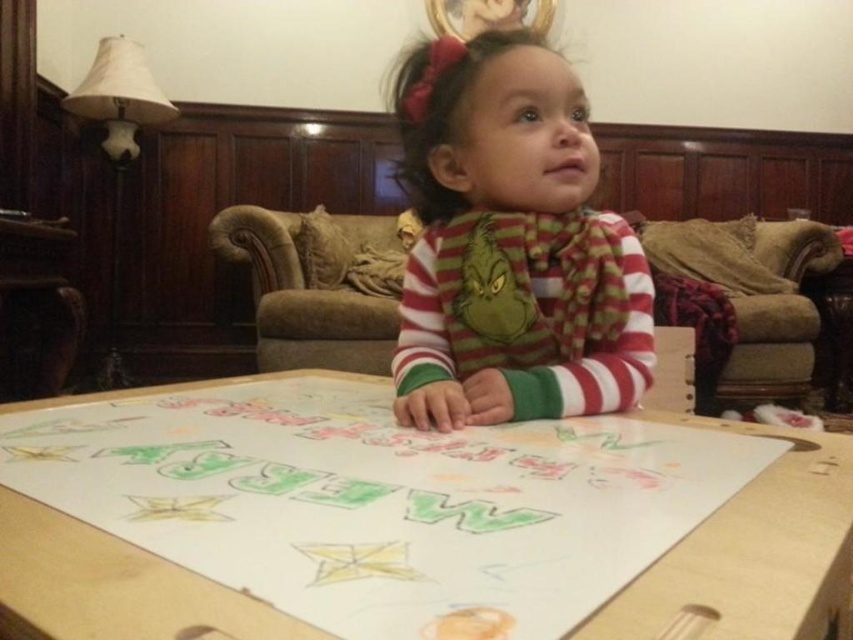
You are a delivery person who needs to place a small package on the wooden table at center. Based on the coordinates provided, where should you aim to place the package?

The wooden table at center is located at point coordinates (x=404, y=520), so you should aim for that coordinate to place the package.

You are a photographer setting up for a portrait. The wooden table at center and the striped cotton shirt at center are both in the scene. Which object is closer to the camera?

The wooden table at center is closer to the camera than the striped cotton shirt at center because it is positioned in front of it.